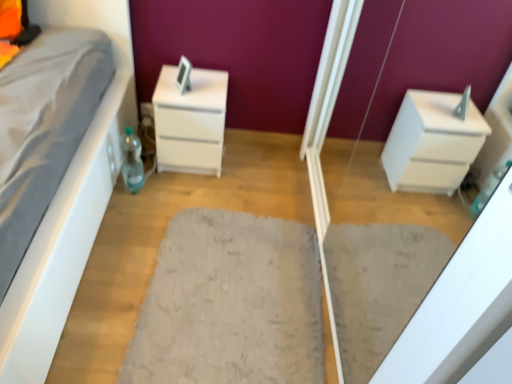
The width and height of the screenshot is (512, 384). Find the location of `vacant space in front of white glossy chest of drawers at center`. vacant space in front of white glossy chest of drawers at center is located at coordinates (182, 193).